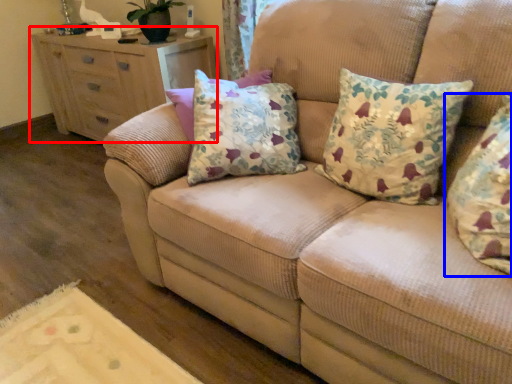
Question: Among these objects, which one is nearest to the camera, chest of drawers (highlighted by a red box) or pillow (highlighted by a blue box)?

Choices:
 (A) chest of drawers
 (B) pillow

Answer: (B)